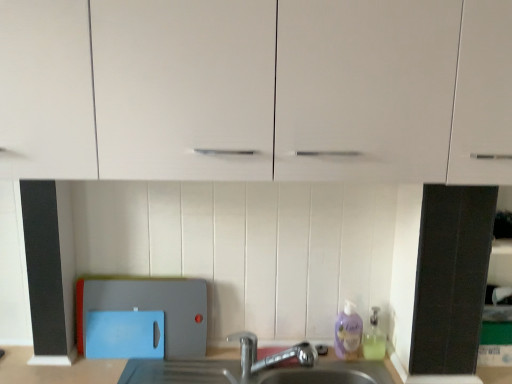
Question: Considering the relative sizes of purple translucent liquid soap at lower right, which is counted as the 1th cleaning product, starting from the left, and translucent plastic soap dispenser at lower right, which is counted as the 1th cleaning product, starting from the right, in the image provided, is purple translucent liquid soap at lower right, which is counted as the 1th cleaning product, starting from the left, wider than translucent plastic soap dispenser at lower right, which is counted as the 1th cleaning product, starting from the right,?

Choices:
 (A) yes
 (B) no

Answer: (B)

Question: From the image's perspective, is purple translucent liquid soap at lower right, the 2th cleaning product when ordered from right to left, under translucent plastic soap dispenser at lower right, which is counted as the 1th cleaning product, starting from the right?

Choices:
 (A) yes
 (B) no

Answer: (B)

Question: Considering the relative positions of purple translucent liquid soap at lower right, which is counted as the 1th cleaning product, starting from the left, and translucent plastic soap dispenser at lower right, which appears as the second cleaning product when viewed from the left, in the image provided, is purple translucent liquid soap at lower right, which is counted as the 1th cleaning product, starting from the left, to the left of translucent plastic soap dispenser at lower right, which appears as the second cleaning product when viewed from the left, from the viewer's perspective?

Choices:
 (A) no
 (B) yes

Answer: (B)

Question: Is purple translucent liquid soap at lower right, which is counted as the 1th cleaning product, starting from the left, positioned with its back to translucent plastic soap dispenser at lower right, which is counted as the 1th cleaning product, starting from the right?

Choices:
 (A) no
 (B) yes

Answer: (A)

Question: From a real-world perspective, is purple translucent liquid soap at lower right, which is counted as the 1th cleaning product, starting from the left, over translucent plastic soap dispenser at lower right, which appears as the second cleaning product when viewed from the left?

Choices:
 (A) yes
 (B) no

Answer: (A)

Question: Is purple translucent liquid soap at lower right, the 2th cleaning product when ordered from right to left, positioned far away from translucent plastic soap dispenser at lower right, which appears as the second cleaning product when viewed from the left?

Choices:
 (A) no
 (B) yes

Answer: (A)

Question: Considering the relative sizes of white glossy cabinet at upper center and blue plastic cutting board at lower left in the image provided, is white glossy cabinet at upper center taller than blue plastic cutting board at lower left?

Choices:
 (A) no
 (B) yes

Answer: (B)

Question: Does white glossy cabinet at upper center lie behind blue plastic cutting board at lower left?

Choices:
 (A) no
 (B) yes

Answer: (A)

Question: Is white glossy cabinet at upper center closer to camera compared to blue plastic cutting board at lower left?

Choices:
 (A) yes
 (B) no

Answer: (A)

Question: Does white glossy cabinet at upper center turn towards blue plastic cutting board at lower left?

Choices:
 (A) yes
 (B) no

Answer: (B)

Question: Is blue plastic cutting board at lower left inside white glossy cabinet at upper center?

Choices:
 (A) yes
 (B) no

Answer: (B)

Question: Is white glossy cabinet at upper center outside of blue plastic cutting board at lower left?

Choices:
 (A) no
 (B) yes

Answer: (B)

Question: Can you confirm if white glossy cabinet at upper center is positioned to the left of silver metallic faucet at lower center?

Choices:
 (A) yes
 (B) no

Answer: (A)